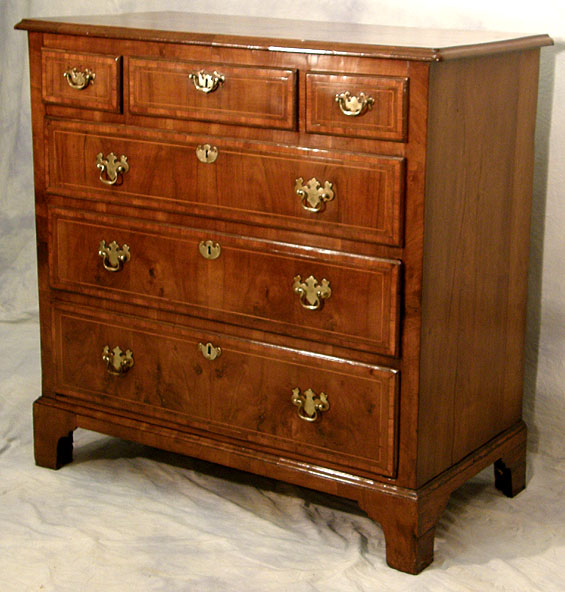
Where is `the bottom drawer`? This screenshot has height=592, width=565. the bottom drawer is located at coordinates (230, 398).